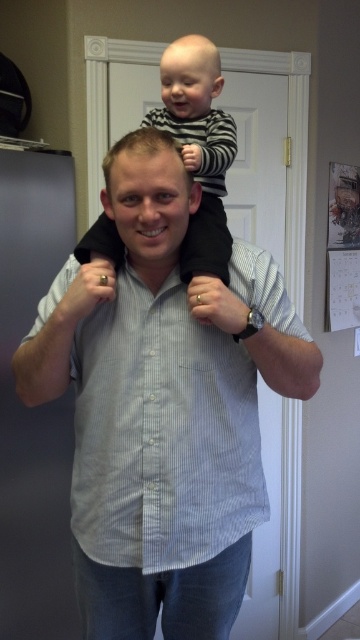
How far apart are light blue striped shirt at center and striped cotton shirt at upper center?

light blue striped shirt at center and striped cotton shirt at upper center are 11.54 inches apart from each other.

Identify the location of light blue striped shirt at center. (162, 433).